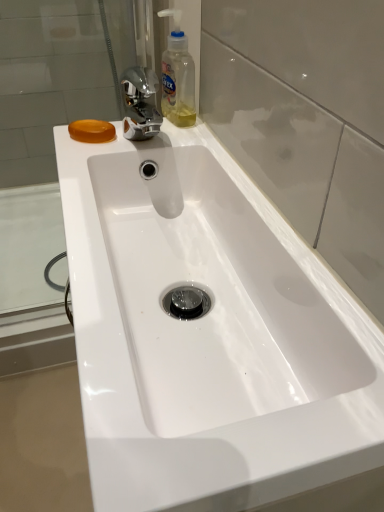
In order to click on free space that is in between translucent plastic bottle at upper center and transparent glass door at center in this screenshot , I will do `click(234, 175)`.